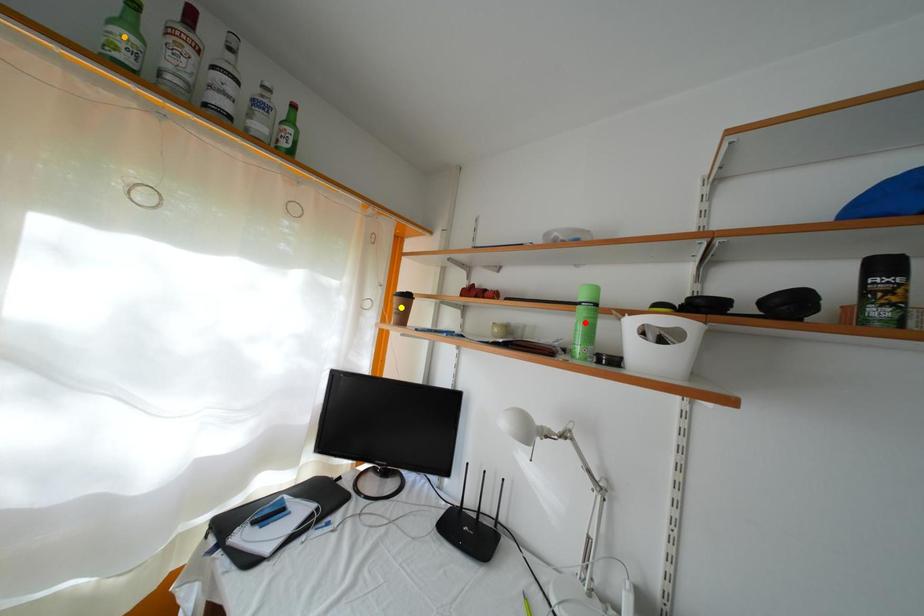
Order these from nearest to farthest:
yellow point
red point
orange point

orange point
red point
yellow point